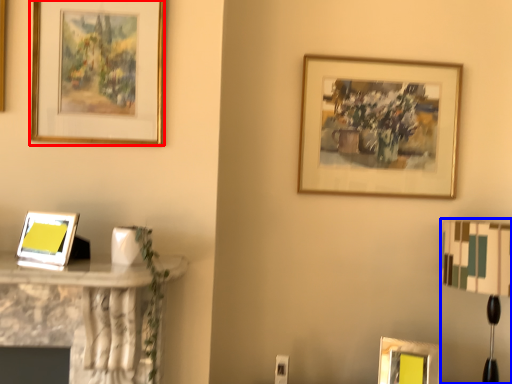
Question: Which point is further to the camera, picture frame (highlighted by a red box) or table lamp (highlighted by a blue box)?

Choices:
 (A) picture frame
 (B) table lamp

Answer: (B)